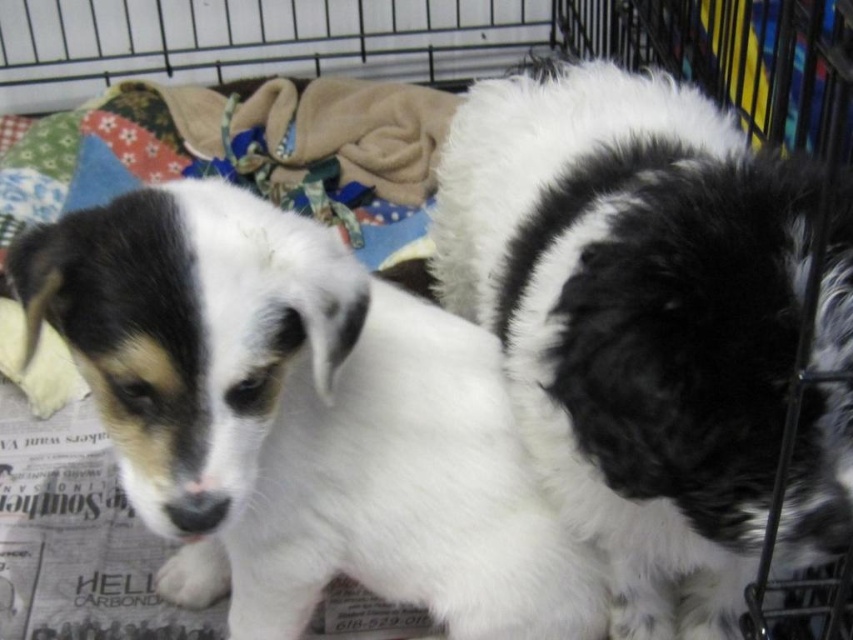
Between white fluffy dog at center and white fur dog at center, which one appears on the left side from the viewer's perspective?

Positioned to the left is white fur dog at center.

Which is above, white fluffy dog at center or white fur dog at center?

white fluffy dog at center is higher up.

Does point (758, 170) come behind point (193, 192)?

No.

Where is `white fluffy dog at center`? white fluffy dog at center is located at coordinates (634, 317).

Between point (850, 346) and point (402, 250), which one is positioned behind?

The point (402, 250) is more distant.

Can you confirm if white fluffy dog at center is smaller than fluffy fleece blanket at upper left?

Correct, white fluffy dog at center occupies less space than fluffy fleece blanket at upper left.

Where is `white fluffy dog at center`? This screenshot has height=640, width=853. white fluffy dog at center is located at coordinates (634, 317).

Describe the element at coordinates (299, 419) in the screenshot. I see `white fur dog at center` at that location.

Does white fur dog at center have a larger size compared to fluffy fleece blanket at upper left?

No, white fur dog at center is not bigger than fluffy fleece blanket at upper left.

The height and width of the screenshot is (640, 853). I want to click on white fur dog at center, so tap(299, 419).